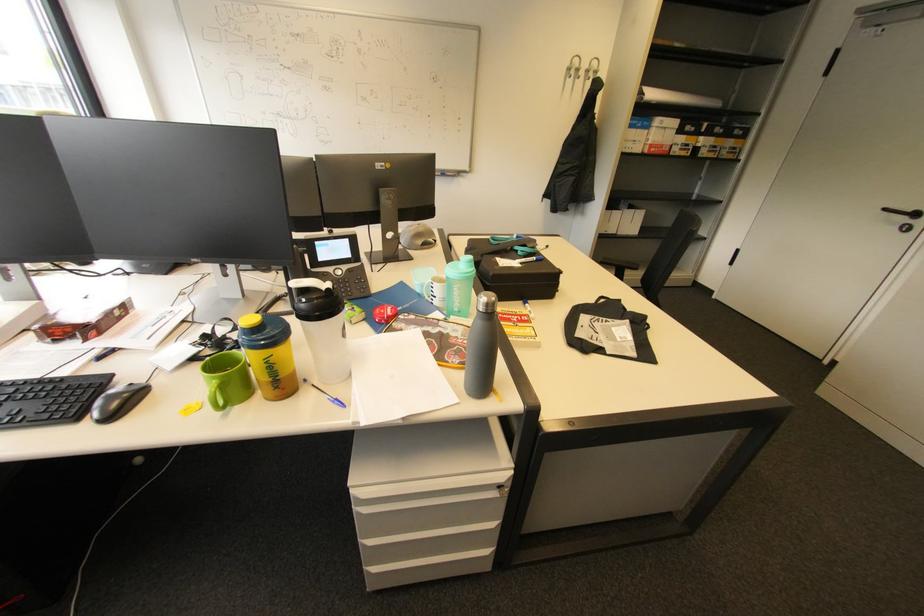
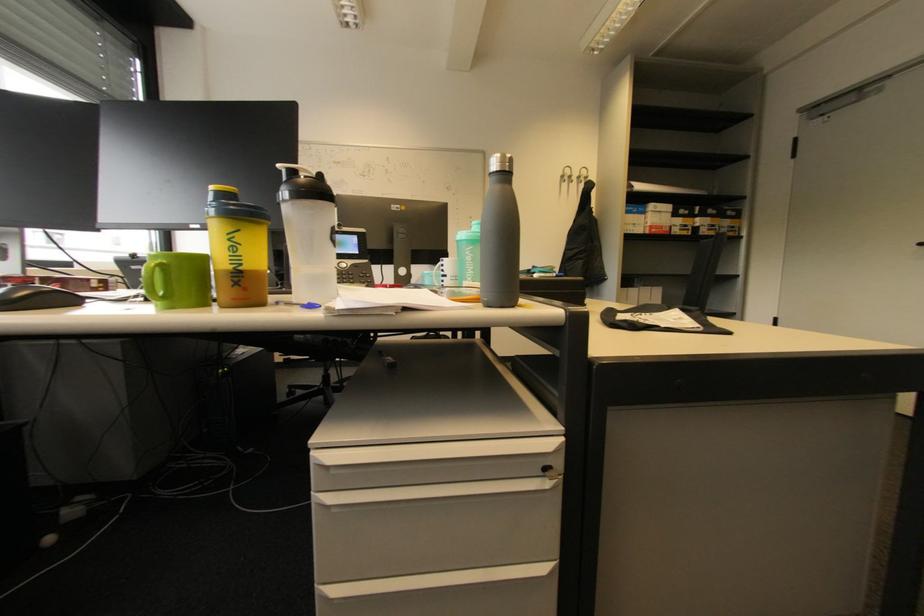
The point at (281, 390) is marked in the first image. Where is the corresponding point in the second image?

(239, 286)